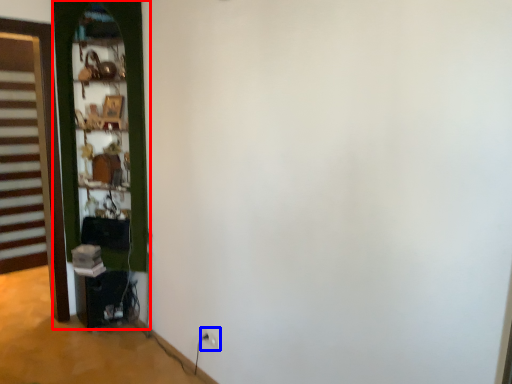
Question: Which object is further to the camera taking this photo, door (highlighted by a red box) or electric outlet (highlighted by a blue box)?

Choices:
 (A) door
 (B) electric outlet

Answer: (A)